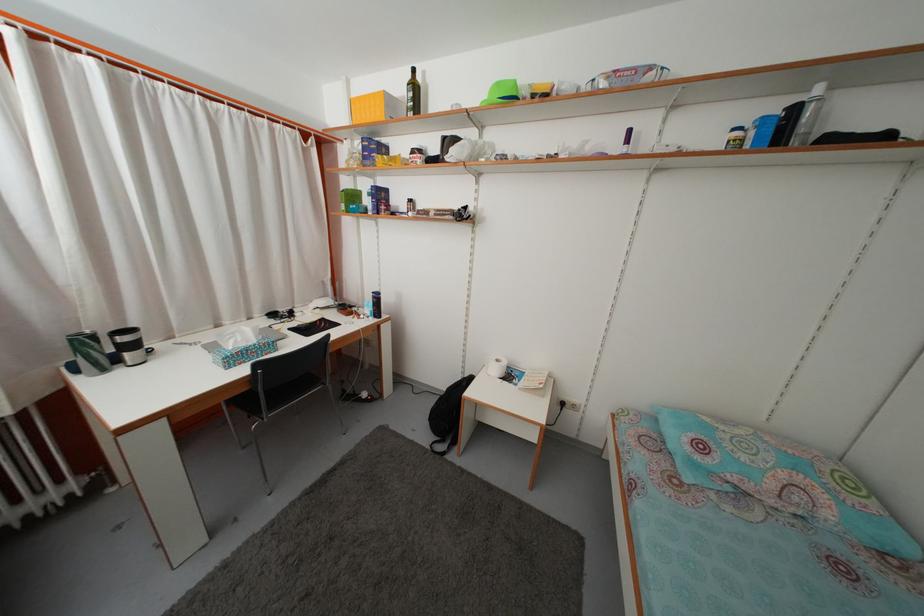
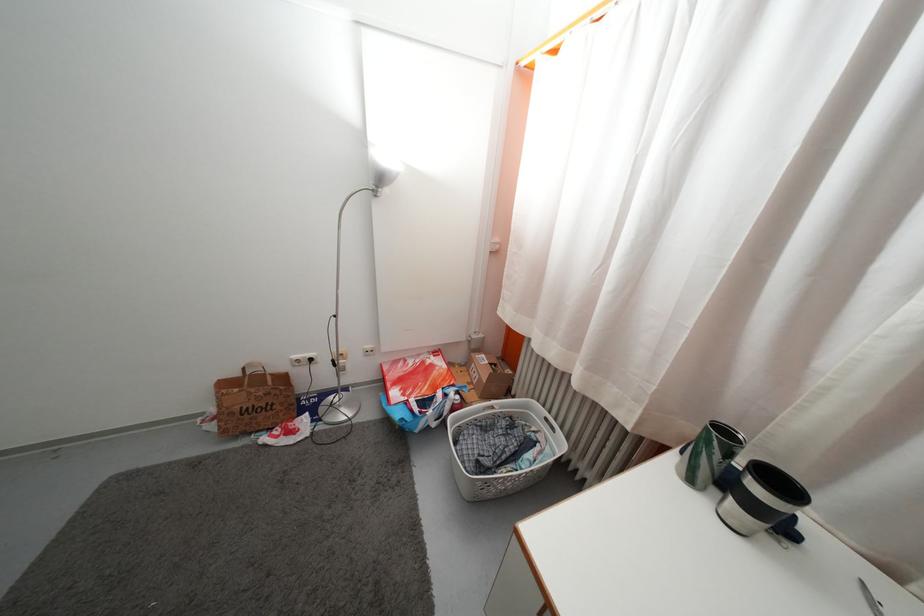
Where in the second image is the point corresponding to [110,378] from the first image?

(697, 488)